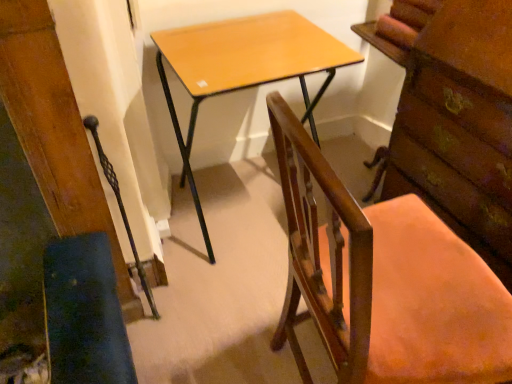
Question: Is wooden chair at center not near light brown wood desk at center?

Choices:
 (A) no
 (B) yes

Answer: (A)

Question: Is wooden chair at center next to light brown wood desk at center?

Choices:
 (A) no
 (B) yes

Answer: (A)

Question: Does wooden chair at center lie in front of light brown wood desk at center?

Choices:
 (A) yes
 (B) no

Answer: (A)

Question: Can you confirm if wooden chair at center is shorter than light brown wood desk at center?

Choices:
 (A) yes
 (B) no

Answer: (B)

Question: Is wooden chair at center positioned with its back to light brown wood desk at center?

Choices:
 (A) yes
 (B) no

Answer: (B)

Question: In terms of size, does wooden chair at center appear bigger or smaller than wooden swivel chair at lower left?

Choices:
 (A) small
 (B) big

Answer: (B)

Question: Do you think wooden chair at center is within wooden swivel chair at lower left, or outside of it?

Choices:
 (A) outside
 (B) inside

Answer: (A)

Question: From the image's perspective, is wooden chair at center positioned above or below wooden swivel chair at lower left?

Choices:
 (A) below
 (B) above

Answer: (A)

Question: Is wooden chair at center wider or thinner than wooden swivel chair at lower left?

Choices:
 (A) thin
 (B) wide

Answer: (B)

Question: Is wooden chest of drawers at right spatially inside light brown wood desk at center, or outside of it?

Choices:
 (A) outside
 (B) inside

Answer: (A)

Question: Considering the positions of wooden chest of drawers at right and light brown wood desk at center in the image, is wooden chest of drawers at right wider or thinner than light brown wood desk at center?

Choices:
 (A) wide
 (B) thin

Answer: (B)

Question: Does point (400, 187) appear closer or farther from the camera than point (237, 82)?

Choices:
 (A) closer
 (B) farther

Answer: (B)

Question: Looking at the image, does wooden chest of drawers at right seem bigger or smaller compared to light brown wood desk at center?

Choices:
 (A) big
 (B) small

Answer: (B)

Question: From the image's perspective, relative to light brown wood desk at center, is wooden swivel chair at lower left above or below?

Choices:
 (A) above
 (B) below

Answer: (B)

Question: Is wooden swivel chair at lower left to the left or to the right of light brown wood desk at center in the image?

Choices:
 (A) left
 (B) right

Answer: (A)